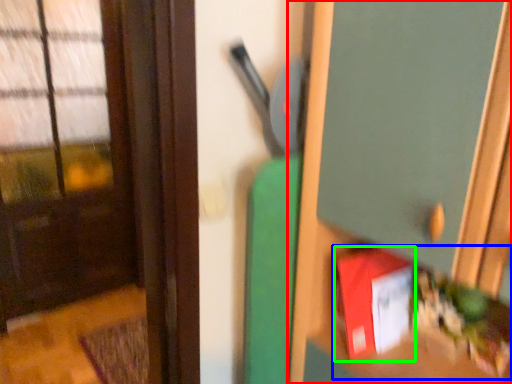
Question: Which is farther away from dresser (highlighted by a red box)? book (highlighted by a blue box) or book (highlighted by a green box)?

Choices:
 (A) book
 (B) book

Answer: (B)